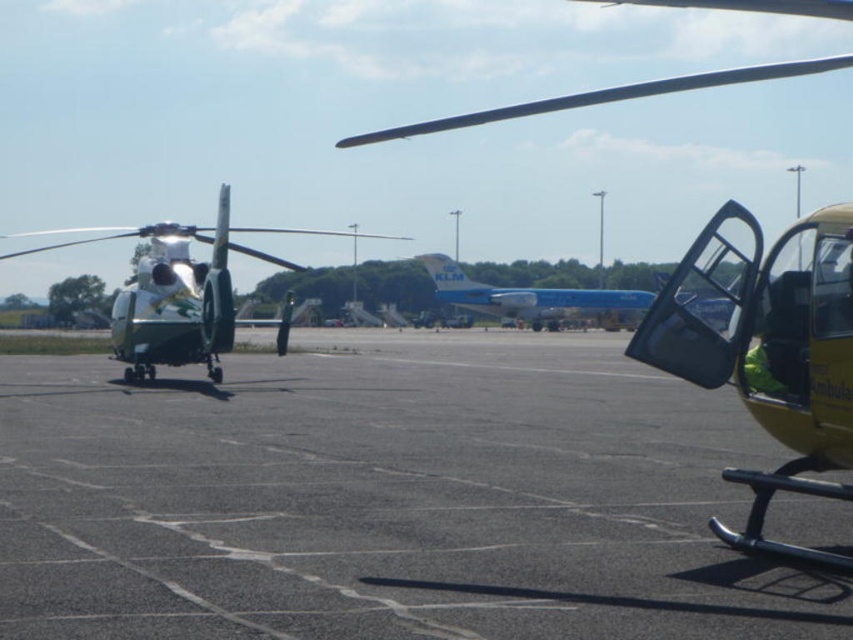
Question: Can you confirm if black asphalt tarmac at center is smaller than white glossy helmet at center?

Choices:
 (A) no
 (B) yes

Answer: (A)

Question: Which of the following is the closest to the observer?

Choices:
 (A) (625, 305)
 (B) (158, 282)
 (C) (843, 224)

Answer: (C)

Question: Does yellow matte helicopter at right appear on the right side of blue glossy airplane at center?

Choices:
 (A) yes
 (B) no

Answer: (A)

Question: Does yellow matte helicopter at right have a lesser width compared to white glossy helmet at center?

Choices:
 (A) yes
 (B) no

Answer: (B)

Question: Which point is closer to the camera taking this photo?

Choices:
 (A) (415, 598)
 (B) (461, 269)
 (C) (131, 380)
 (D) (157, 291)

Answer: (A)

Question: Which is nearer to the white glossy helicopter at left?

Choices:
 (A) white glossy helmet at center
 (B) yellow matte helicopter at right

Answer: (B)